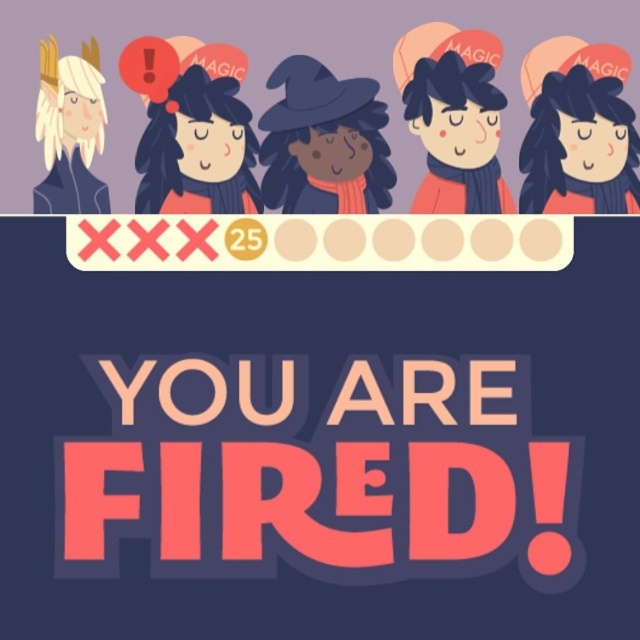
You are an AI analyzing an image of five characters standing side by side against a purple background. The characters are described as follows from left to right. The first has light hair in a high ponytail and a dark outfit with a high collar. The second has dark hair with a red ribbon and a red exclamation mark above their head, wearing a red top. The third is in a witch hat and scarf. The fourth and fifth are not described here. You see the bold pink text at center. Based on their positions, which of the

The bold pink text at center is located at point (321, 474). Since the characters are arranged from left to right, the third character is positioned at the center. Therefore, the bold pink text at center is positioned to the right of the third character, which is wearing a witch hat and scarf.

You are a character in the image and need to move from the matte witch hat at center to the matte black figure at left. Which direction should you move?

To move from the matte witch hat at center to the matte black figure at left, you should move to the right because the matte black figure at left is positioned to the right of the matte witch hat at center.